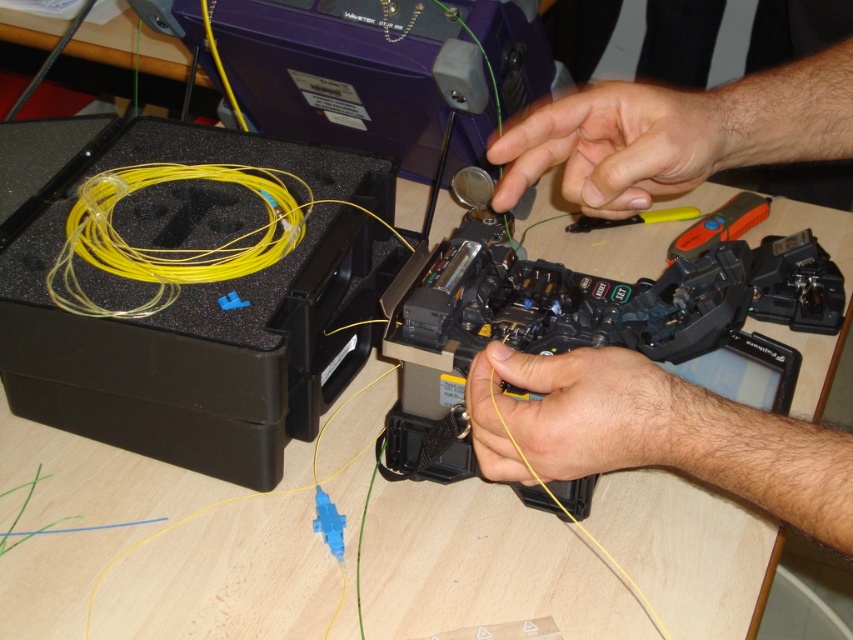
What are the coordinates of the yellow matte wire at center in the image?

The yellow matte wire at center is located at coordinates point (579, 413).

You are a technician working on the fiber optic cable setup. You need to access the orange plastic tool at center and the yellow plastic tool at center. Based on their positions, which tool is directly above the other?

The yellow plastic tool at center is directly above the orange plastic tool at center because the orange plastic tool at center is positioned under the yellow plastic tool at center.